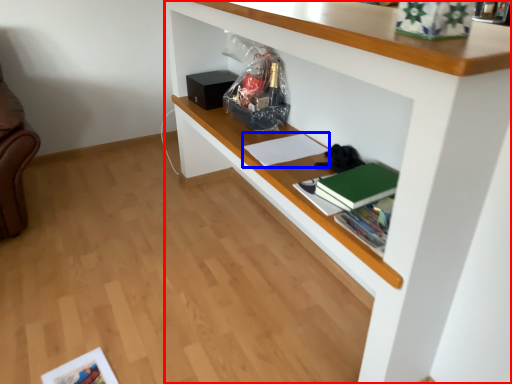
Question: Which object is closer to the camera taking this photo, shelf (highlighted by a red box) or book (highlighted by a blue box)?

Choices:
 (A) shelf
 (B) book

Answer: (A)